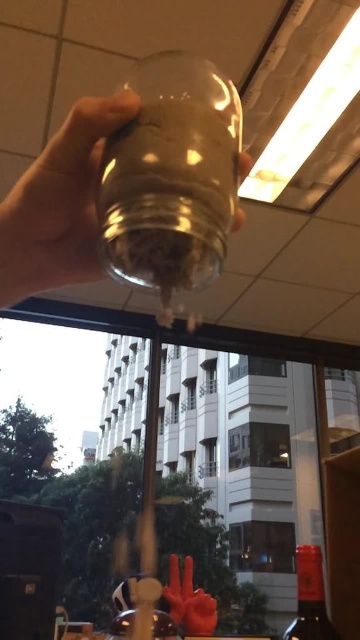
Is translucent glass wine bottle at lower right below rubber glove at lower center?

No.

Can you confirm if translucent glass wine bottle at lower right is bigger than rubber glove at lower center?

No, translucent glass wine bottle at lower right is not bigger than rubber glove at lower center.

Does point (299, 557) come closer to viewer compared to point (186, 561)?

Yes, point (299, 557) is closer to viewer.

Identify the location of translucent glass wine bottle at lower right. (309, 598).

Which of these two, transparent glass jar at upper left or rubber glove at lower center, stands taller?

rubber glove at lower center is taller.

Does transparent glass jar at upper left lie in front of rubber glove at lower center?

Yes, transparent glass jar at upper left is in front of rubber glove at lower center.

Is point (42, 172) less distant than point (210, 618)?

Yes, point (42, 172) is closer to viewer.

Locate an element on the screen. This screenshot has height=640, width=360. transparent glass jar at upper left is located at coordinates (59, 204).

Is transparent glass jar at upper left taller than translucent glass wine bottle at lower right?

Yes, transparent glass jar at upper left is taller than translucent glass wine bottle at lower right.

Is transparent glass jar at upper left closer to the viewer compared to translucent glass wine bottle at lower right?

That is True.

Is point (48, 227) behind point (306, 602)?

That is False.

In order to click on transparent glass jar at upper left in this screenshot , I will do tap(59, 204).